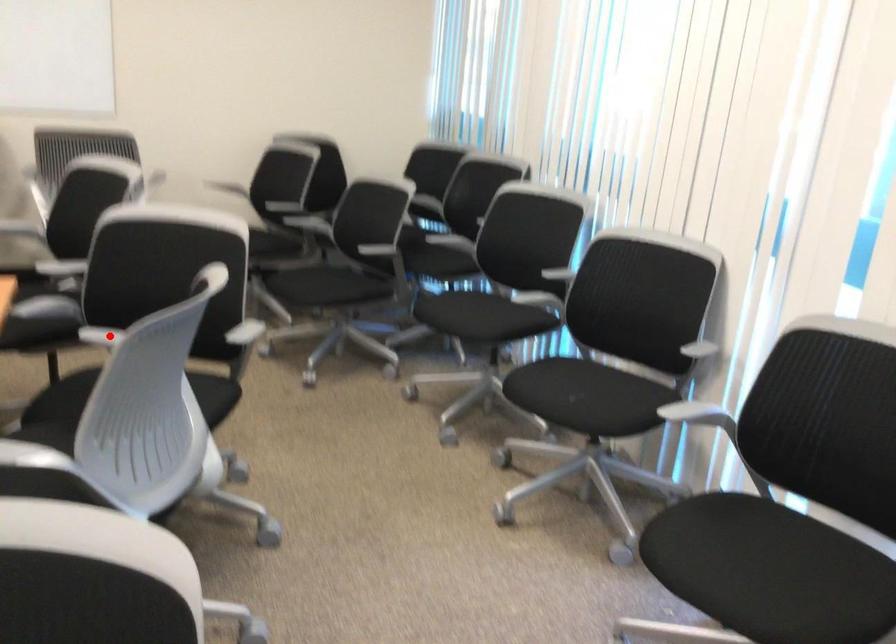
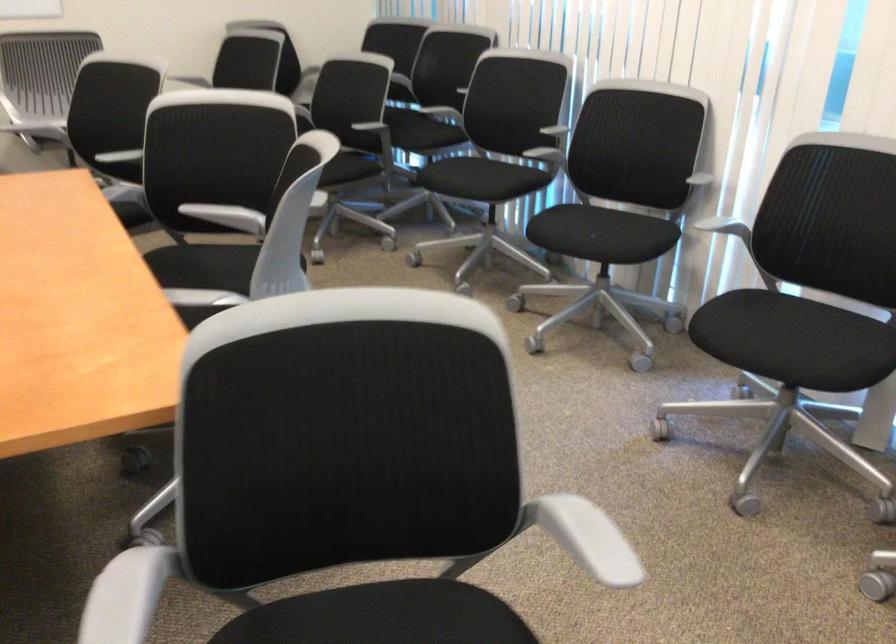
The point at the highlighted location is marked in the first image. Where is the corresponding point in the second image?

(208, 212)